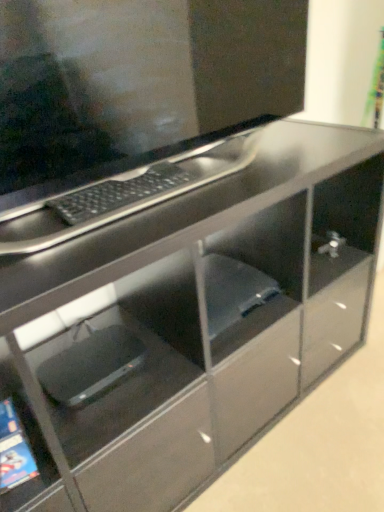
This screenshot has width=384, height=512. Identify the location of free point to the right of black matte keyboard at upper center. (219, 184).